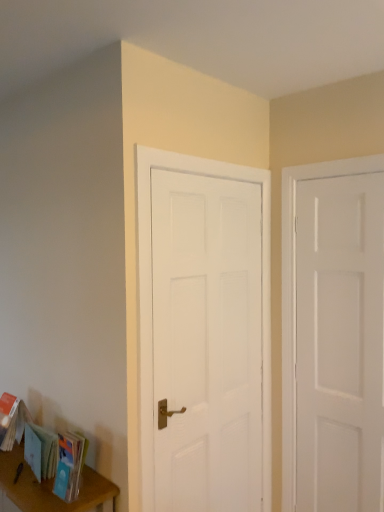
Locate an element on the screen. The image size is (384, 512). free space to the left of matte blue paperback book at lower left is located at coordinates 33,493.